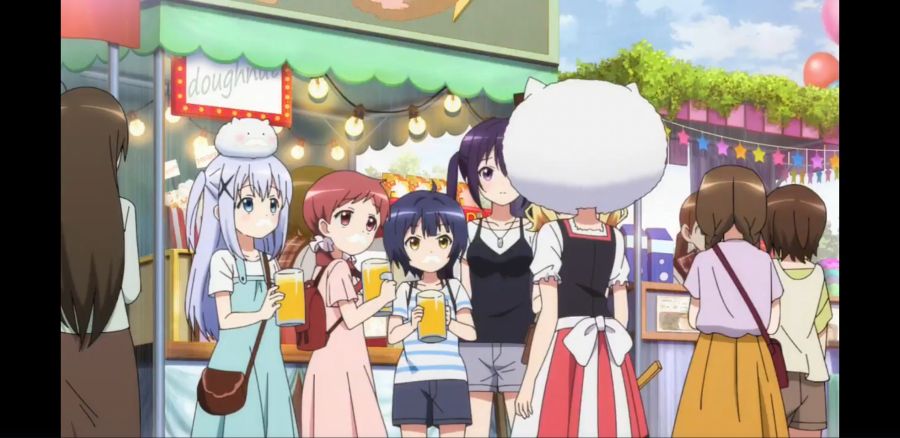
Find the location of a particular element. clear glass mugs is located at coordinates (276, 276), (365, 263), (419, 294).